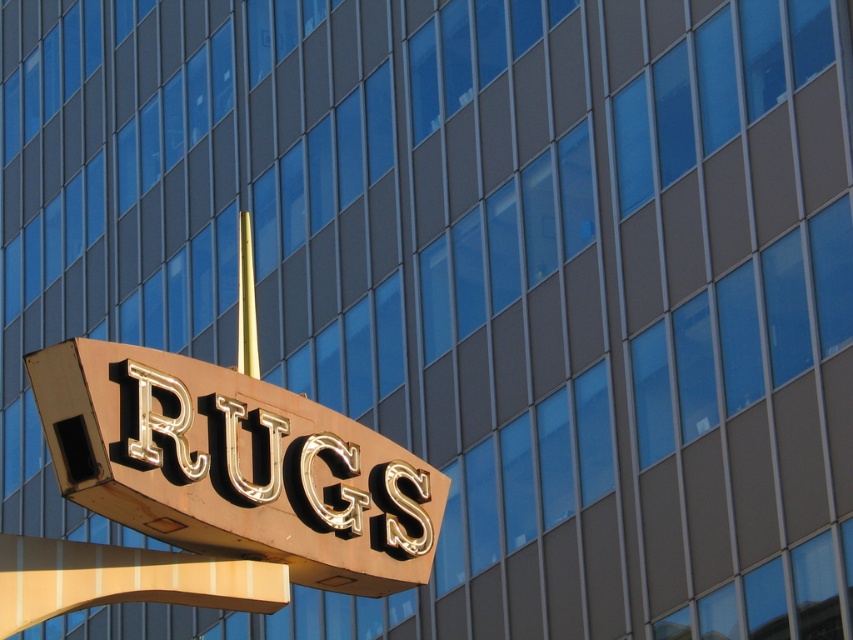
Consider the image. Is gold metallic sign at center positioned at the back of gold polished pole at center?

No, it is not.

Is gold metallic sign at center smaller than gold polished pole at center?

Yes, gold metallic sign at center is smaller than gold polished pole at center.

I want to click on gold metallic sign at center, so click(235, 467).

Between rustic wood sign at center and gold polished pole at center, which one is positioned lower?

rustic wood sign at center is below.

Is rustic wood sign at center smaller than gold polished pole at center?

Yes.

Who is more forward, (0,589) or (252,266)?

Positioned in front is point (0,589).

You are a GUI agent. You are given a task and a screenshot of the screen. Output one action in this format:
    pyautogui.click(x=<x>, y=<y>)
    Task: Click on the rustic wood sign at center
    Image resolution: width=853 pixels, height=640 pixels.
    Given the screenshot: What is the action you would take?
    pyautogui.click(x=125, y=579)

Is gold metallic sign at center to the right of rustic wood sign at center from the viewer's perspective?

Indeed, gold metallic sign at center is positioned on the right side of rustic wood sign at center.

Does gold metallic sign at center appear under rustic wood sign at center?

Actually, gold metallic sign at center is above rustic wood sign at center.

Between point (357, 493) and point (61, 544), which one is positioned in front?

Positioned in front is point (61, 544).

The height and width of the screenshot is (640, 853). I want to click on gold metallic sign at center, so click(235, 467).